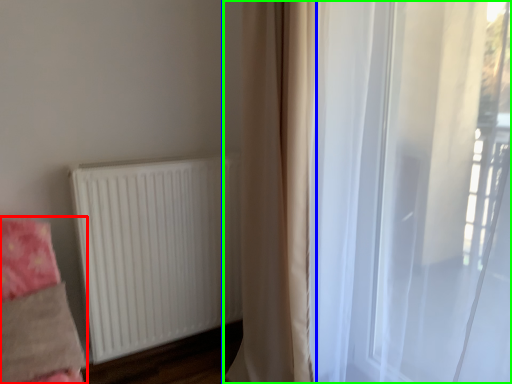
Question: Which object is the farthest from bedding (highlighted by a red box)? Choose among these: curtain (highlighted by a blue box) or curtain (highlighted by a green box).

Choices:
 (A) curtain
 (B) curtain

Answer: (B)